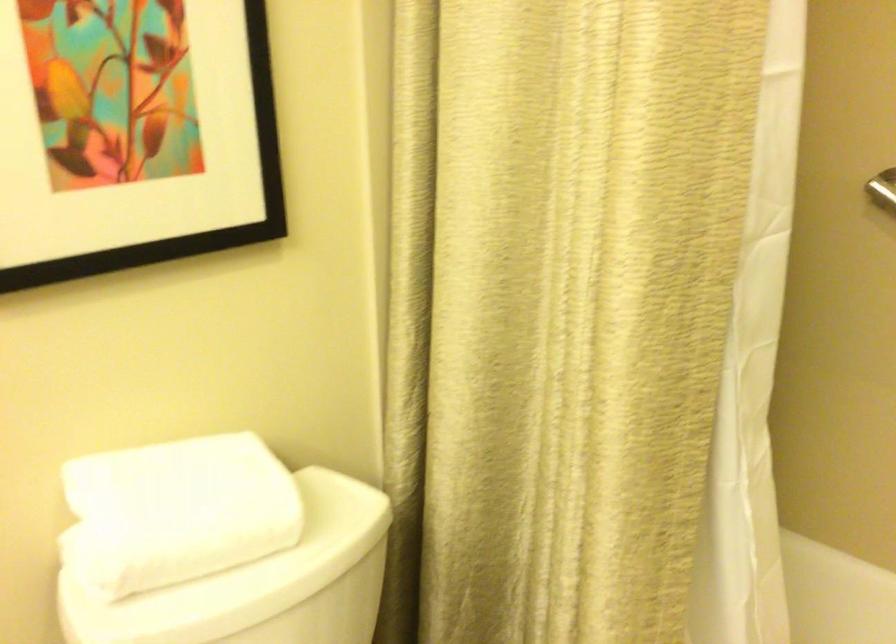
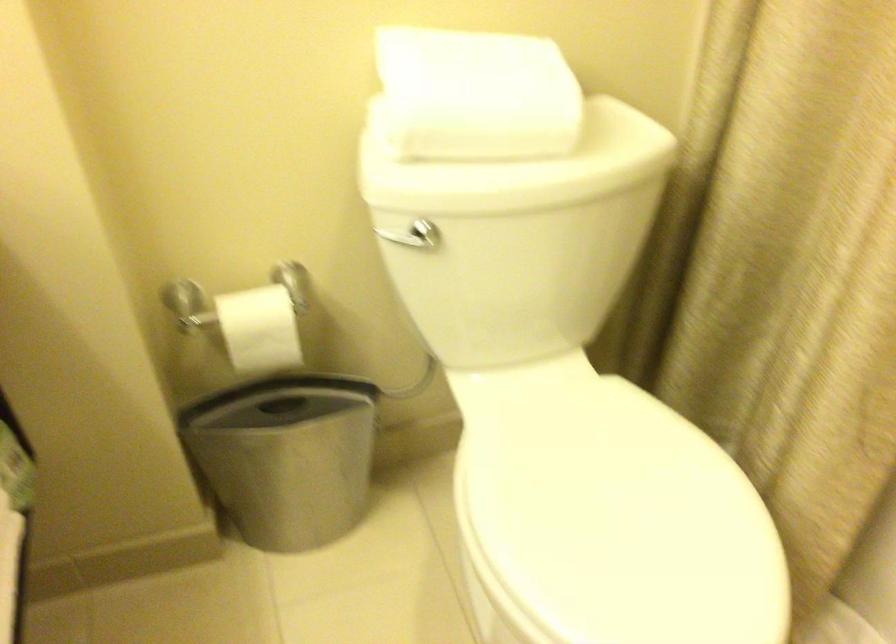
In the second image, find the point that corresponds to the point at 194,516 in the first image.

(476, 95)